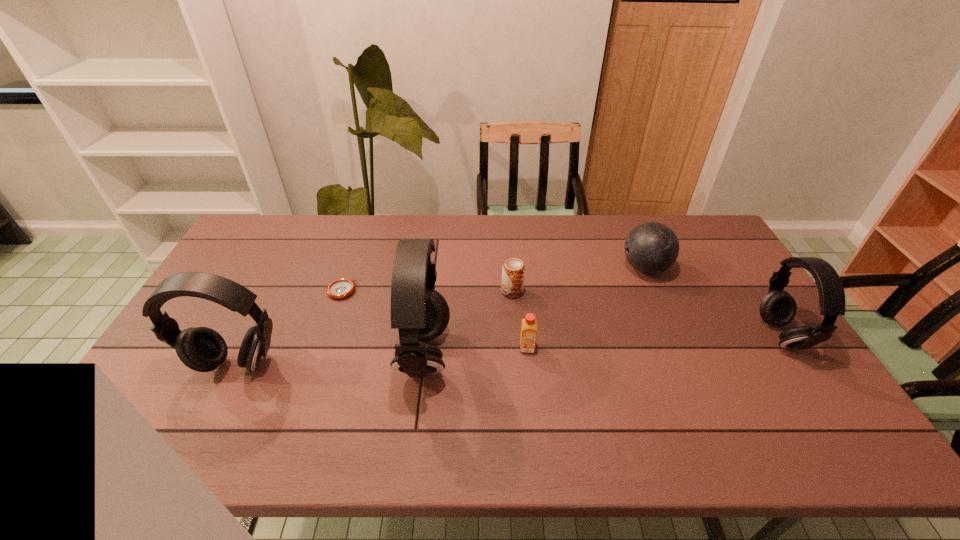
Locate an element on the screen. Image resolution: width=960 pixels, height=540 pixels. free space at the far left corner is located at coordinates (263, 235).

This screenshot has height=540, width=960. Identify the location of free space between the compass and the rightmost earphone. (561, 313).

Where is `free spot between the fifth object from right to left and the beer can`? The height and width of the screenshot is (540, 960). free spot between the fifth object from right to left and the beer can is located at coordinates (468, 322).

At what (x,y) coordinates should I click in order to perform the action: click on free spot between the second earphone from left to right and the rightmost earphone. Please return your answer as a coordinate pair (x, y). Looking at the image, I should click on (602, 344).

At what (x,y) coordinates should I click in order to perform the action: click on free space between the second tallest earphone and the fifth shortest object. Please return your answer as a coordinate pair (x, y). The height and width of the screenshot is (540, 960). Looking at the image, I should click on (507, 349).

Identify the location of free point between the second earphone from right to left and the rightmost earphone. This screenshot has width=960, height=540. (602, 344).

Locate an element on the screen. The height and width of the screenshot is (540, 960). free space between the bowling ball and the rightmost object is located at coordinates (712, 301).

The width and height of the screenshot is (960, 540). In order to click on free space between the orange juice and the beer can in this screenshot , I will do `click(519, 320)`.

Where is `unoccupied area between the sixth object from left to right and the second earphone from right to left`? unoccupied area between the sixth object from left to right and the second earphone from right to left is located at coordinates (x=535, y=310).

Image resolution: width=960 pixels, height=540 pixels. What are the coordinates of `free space between the rightmost earphone and the leftmost object` in the screenshot? It's located at (507, 349).